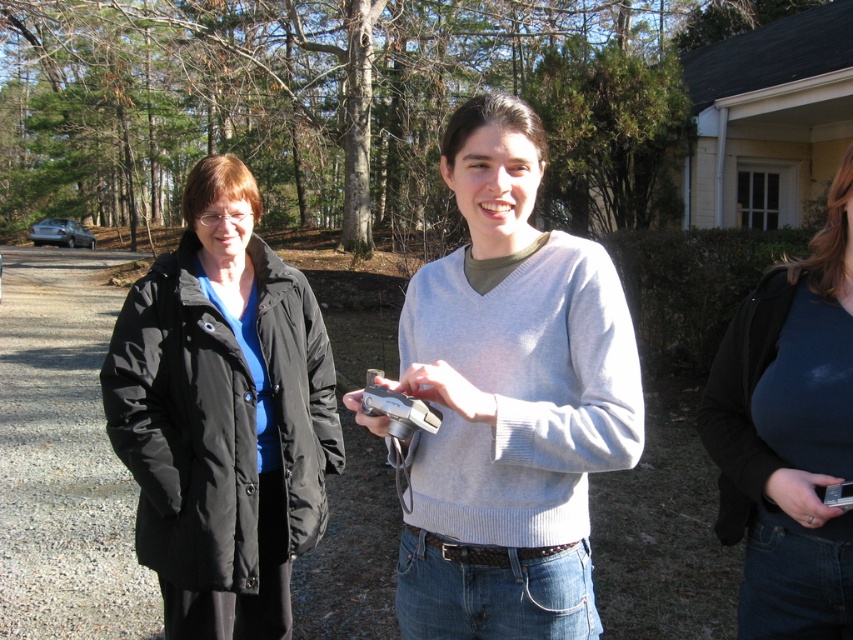
Is point (270, 292) closer to viewer compared to point (781, 332)?

No, (270, 292) is further to viewer.

Can you confirm if black puffy coat at left is positioned to the right of dark blue jersey at center?

In fact, black puffy coat at left is to the left of dark blue jersey at center.

The image size is (853, 640). What do you see at coordinates (223, 416) in the screenshot? I see `black puffy coat at left` at bounding box center [223, 416].

Identify the location of black puffy coat at left. (223, 416).